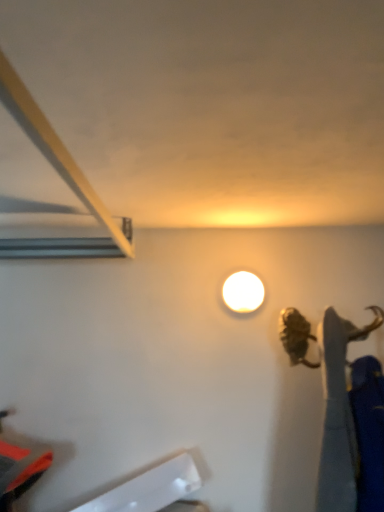
Identify the location of white plastic ruler at lower left. The height and width of the screenshot is (512, 384). (150, 488).

The image size is (384, 512). Describe the element at coordinates (150, 488) in the screenshot. I see `white plastic ruler at lower left` at that location.

This screenshot has width=384, height=512. What do you see at coordinates (243, 292) in the screenshot?
I see `white glossy lamp at upper center` at bounding box center [243, 292].

You are a GUI agent. You are given a task and a screenshot of the screen. Output one action in this format:
    pyautogui.click(x=<x>, y=<y>)
    Task: Click on the white glossy lamp at upper center
    The image size is (384, 512).
    Given the screenshot: What is the action you would take?
    coord(243,292)

You are a GUI agent. You are given a task and a screenshot of the screen. Output one action in this format:
    pyautogui.click(x=<x>, y=<y>)
    Task: Click on the white plastic ruler at lower left
    The height and width of the screenshot is (512, 384).
    Given the screenshot: What is the action you would take?
    150,488

Visually, is white plastic ruler at lower left positioned to the left or to the right of white glossy lamp at upper center?

white plastic ruler at lower left is positioned on white glossy lamp at upper center's left side.

Is the position of white plastic ruler at lower left less distant than that of white glossy lamp at upper center?

Yes, white plastic ruler at lower left is closer to the camera.

Which point is more distant from viewer, (130, 504) or (227, 303)?

The point (227, 303) is behind.

From the image's perspective, is white plastic ruler at lower left located above or below white glossy lamp at upper center?

white plastic ruler at lower left is below white glossy lamp at upper center.

From a real-world perspective, is white plastic ruler at lower left located higher than white glossy lamp at upper center?

No, from a real-world perspective, white plastic ruler at lower left is not above white glossy lamp at upper center.

Between white plastic ruler at lower left and white glossy lamp at upper center, which one has larger width?

white plastic ruler at lower left.

Which of these two, white plastic ruler at lower left or white glossy lamp at upper center, stands shorter?

Standing shorter between the two is white glossy lamp at upper center.

Is white plastic ruler at lower left smaller than white glossy lamp at upper center?

Actually, white plastic ruler at lower left might be larger than white glossy lamp at upper center.

Do you think white plastic ruler at lower left is within white glossy lamp at upper center, or outside of it?

white plastic ruler at lower left exists outside the volume of white glossy lamp at upper center.

Is white plastic ruler at lower left in contact with white glossy lamp at upper center?

No, white plastic ruler at lower left is not making contact with white glossy lamp at upper center.

Is white plastic ruler at lower left turned away from white glossy lamp at upper center?

No, white plastic ruler at lower left is not facing the opposite direction of white glossy lamp at upper center.

Locate an element on the screen. wide on the left of white glossy lamp at upper center is located at coordinates (150, 488).

Can you confirm if white glossy lamp at upper center is positioned to the right of white plastic ruler at lower left?

Yes, white glossy lamp at upper center is to the right of white plastic ruler at lower left.

Looking at this image, is white glossy lamp at upper center further to the viewer compared to white plastic ruler at lower left?

Yes, it is.

Considering the points (245, 282) and (168, 502), which point is behind, point (245, 282) or point (168, 502)?

The point (245, 282) is farther.

From the image's perspective, is white glossy lamp at upper center positioned above or below white plastic ruler at lower left?

white glossy lamp at upper center is above white plastic ruler at lower left.

From a real-world perspective, is white glossy lamp at upper center physically located above or below white plastic ruler at lower left?

From a real-world perspective, white glossy lamp at upper center is physically above white plastic ruler at lower left.

Looking at their sizes, would you say white glossy lamp at upper center is wider or thinner than white plastic ruler at lower left?

Clearly, white glossy lamp at upper center has less width compared to white plastic ruler at lower left.

Which of these two, white glossy lamp at upper center or white plastic ruler at lower left, stands taller?

Standing taller between the two is white plastic ruler at lower left.

Does white glossy lamp at upper center have a larger size compared to white plastic ruler at lower left?

Actually, white glossy lamp at upper center might be smaller than white plastic ruler at lower left.

Is white glossy lamp at upper center outside of white plastic ruler at lower left?

Yes, white glossy lamp at upper center is located beyond the bounds of white plastic ruler at lower left.

Looking at this image, is white glossy lamp at upper center touching white plastic ruler at lower left?

No, white glossy lamp at upper center is not with white plastic ruler at lower left.

Is white glossy lamp at upper center facing towards white plastic ruler at lower left?

No, white glossy lamp at upper center is not turned towards white plastic ruler at lower left.

Can you tell me how much white glossy lamp at upper center and white plastic ruler at lower left differ in facing direction?

The angular difference between white glossy lamp at upper center and white plastic ruler at lower left is 0.797 degrees.

Find the location of a particular element. The width and height of the screenshot is (384, 512). wide that appears on the left of white glossy lamp at upper center is located at coordinates (150, 488).

At what (x,y) coordinates should I click in order to perform the action: click on lamp behind the white plastic ruler at lower left. Please return your answer as a coordinate pair (x, y). Looking at the image, I should click on tap(243, 292).

Locate an element on the screen. lamp that appears above the white plastic ruler at lower left (from the image's perspective) is located at coordinates (243, 292).